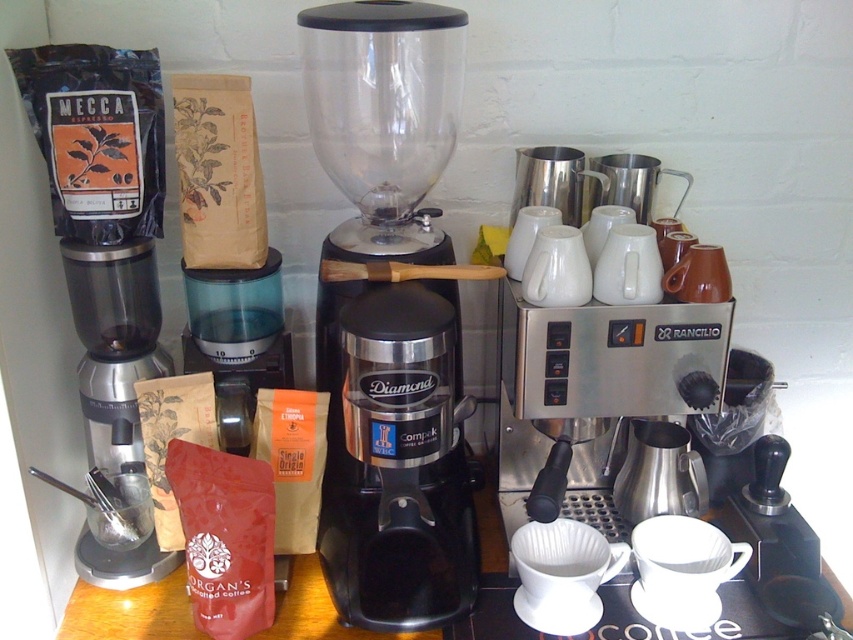
Question: Which point is farther from the camera taking this photo?

Choices:
 (A) (287, 349)
 (B) (82, 356)
 (C) (508, 317)
 (D) (392, 198)

Answer: (B)

Question: Can you confirm if black plastic blender at center is bigger than transparent plastic container at center?

Choices:
 (A) yes
 (B) no

Answer: (A)

Question: Observing the image, what is the correct spatial positioning of black plastic blender at center in reference to stainless steel espresso machine at center right?

Choices:
 (A) below
 (B) above

Answer: (B)

Question: Which is farther from the matte black grinder at left?

Choices:
 (A) stainless steel espresso machine at center right
 (B) black plastic blender at center
 (C) transparent plastic container at center

Answer: (A)

Question: Which point appears farthest from the camera in this image?

Choices:
 (A) 358,440
 (B) 268,349

Answer: (B)

Question: Is matte black grinder at left to the right of transparent plastic container at center from the viewer's perspective?

Choices:
 (A) no
 (B) yes

Answer: (A)